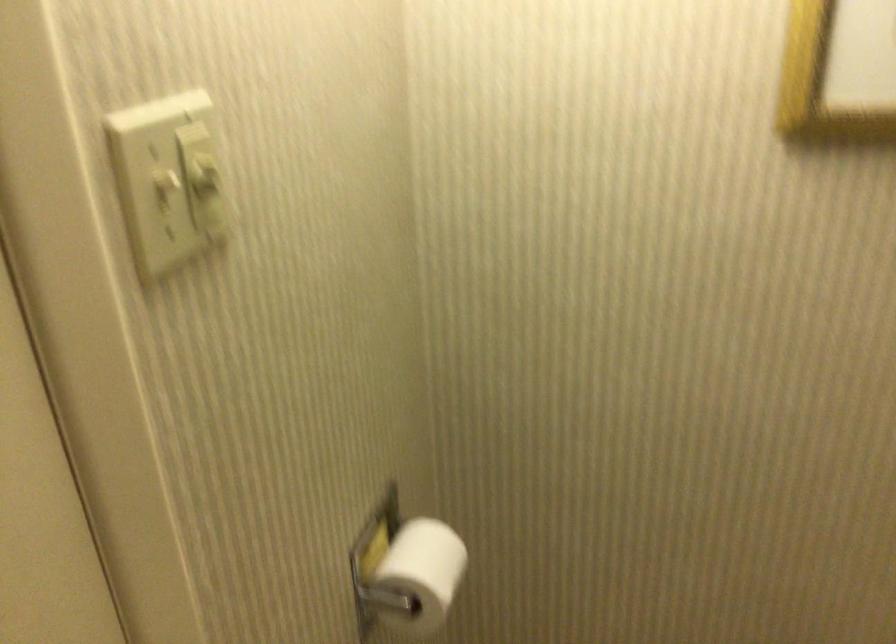
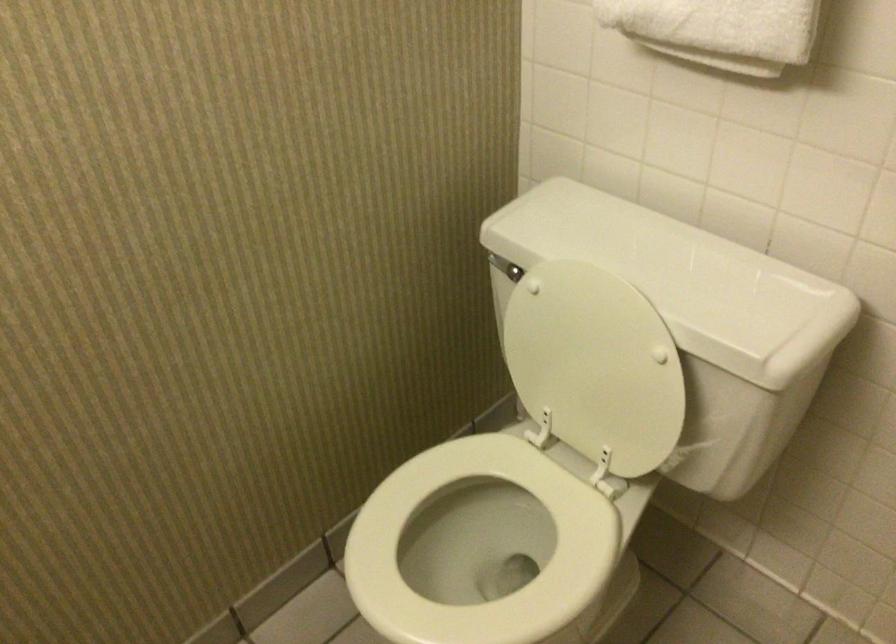
First-person continuous shooting, in which direction is the camera rotating?

The camera's rotation is toward right-down.